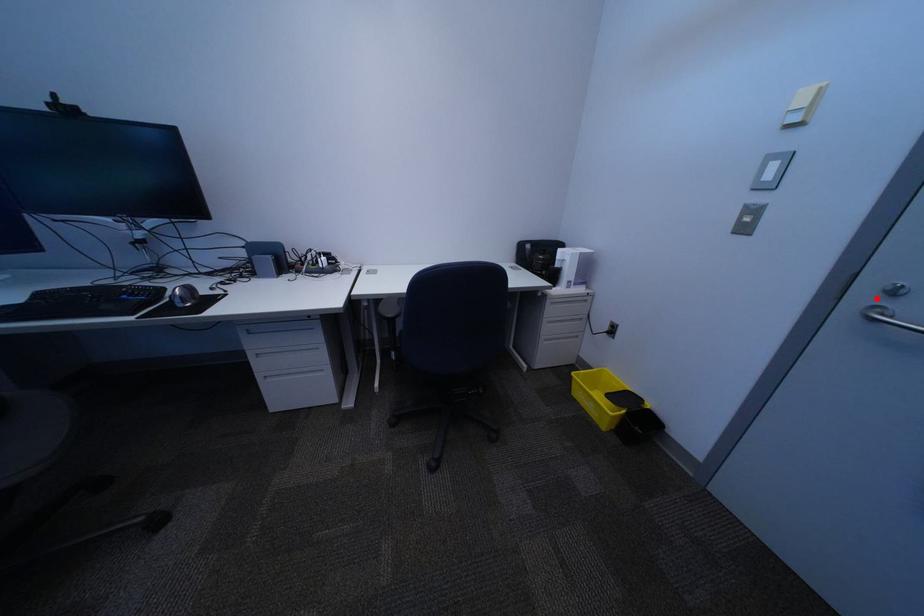
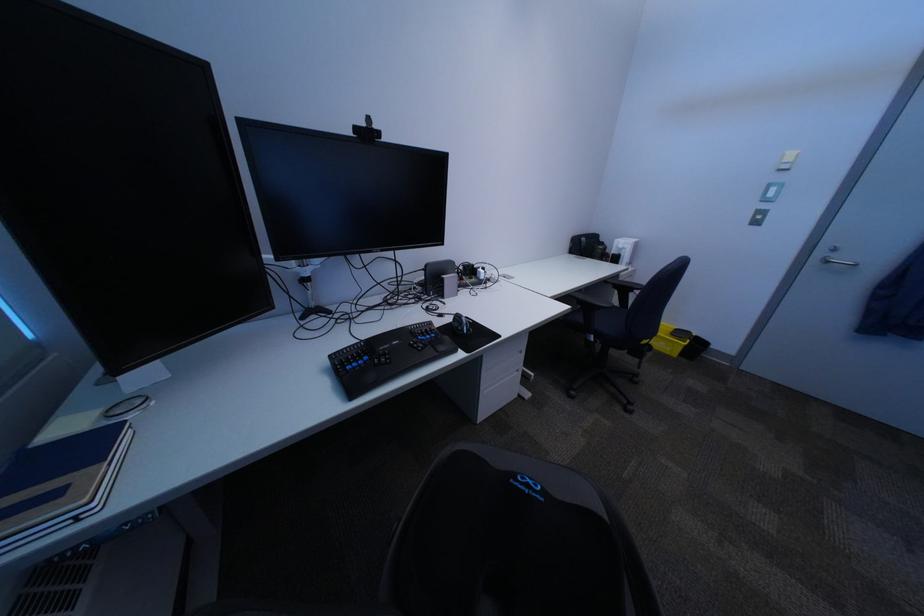
Find the pixel in the second image that matches the highlighted location in the first image.

(834, 254)